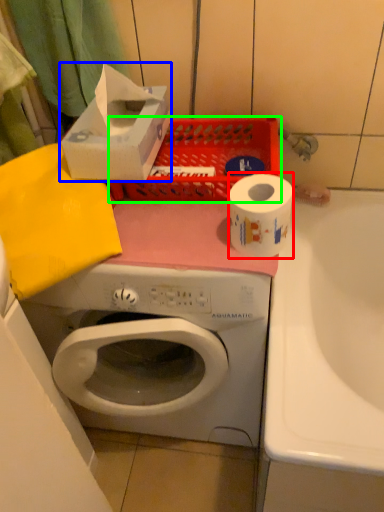
Question: Estimate the real-world distances between objects in this image. Which object is closer to toilet paper (highlighted by a red box), storage box (highlighted by a blue box) or basket (highlighted by a green box)?

Choices:
 (A) storage box
 (B) basket

Answer: (B)